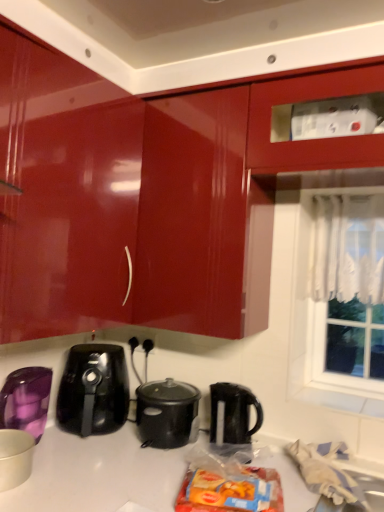
Question: Does glossy red cabinet at upper center have a greater height compared to black matte slow cooker at center?

Choices:
 (A) yes
 (B) no

Answer: (A)

Question: From a real-world perspective, does glossy red cabinet at upper center sit lower than black matte slow cooker at center?

Choices:
 (A) yes
 (B) no

Answer: (B)

Question: Can you confirm if glossy red cabinet at upper center is thinner than black matte slow cooker at center?

Choices:
 (A) no
 (B) yes

Answer: (A)

Question: From the image's perspective, is glossy red cabinet at upper center under black matte slow cooker at center?

Choices:
 (A) yes
 (B) no

Answer: (B)

Question: Does glossy red cabinet at upper center have a lesser height compared to black matte slow cooker at center?

Choices:
 (A) yes
 (B) no

Answer: (B)

Question: Considering the relative sizes of glossy red cabinet at upper center and black matte slow cooker at center in the image provided, is glossy red cabinet at upper center smaller than black matte slow cooker at center?

Choices:
 (A) yes
 (B) no

Answer: (B)

Question: From the image's perspective, is purple glossy cup at lower left, placed as the 2th kitchen appliance when sorted from front to back, under black glossy air fryer at lower center?

Choices:
 (A) no
 (B) yes

Answer: (B)

Question: Considering the relative sizes of purple glossy cup at lower left, placed as the 2th kitchen appliance when sorted from front to back, and black glossy air fryer at lower center in the image provided, is purple glossy cup at lower left, placed as the 2th kitchen appliance when sorted from front to back, bigger than black glossy air fryer at lower center?

Choices:
 (A) yes
 (B) no

Answer: (B)

Question: From a real-world perspective, is purple glossy cup at lower left, placed as the 2th kitchen appliance when sorted from front to back, under black glossy air fryer at lower center?

Choices:
 (A) yes
 (B) no

Answer: (A)

Question: Is purple glossy cup at lower left, placed as the 2th kitchen appliance when sorted from front to back, shorter than black glossy air fryer at lower center?

Choices:
 (A) no
 (B) yes

Answer: (B)

Question: Is the position of purple glossy cup at lower left, placed as the 2th kitchen appliance when sorted from front to back, more distant than that of black glossy air fryer at lower center?

Choices:
 (A) no
 (B) yes

Answer: (A)

Question: Are purple glossy cup at lower left, positioned as the first kitchen appliance in back-to-front order, and black glossy air fryer at lower center far apart?

Choices:
 (A) yes
 (B) no

Answer: (B)

Question: Could you tell me if black plastic kettle at center is turned towards white lace curtain at upper right?

Choices:
 (A) no
 (B) yes

Answer: (A)